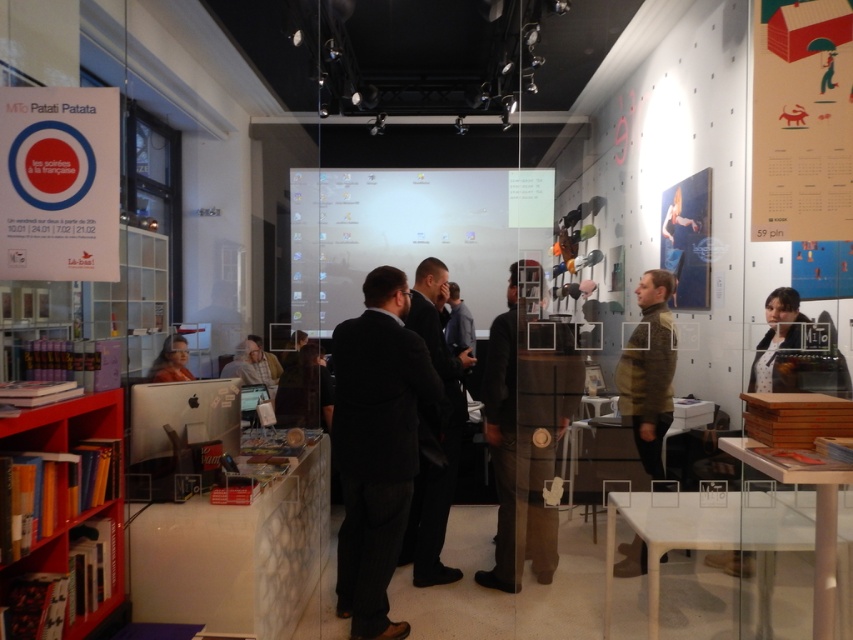
Question: Which object appears closest to the camera in this image?

Choices:
 (A) red wooden bookshelf at lower left
 (B) white paper poster at upper left
 (C) black woolen suit at center
 (D) matte paper calendar at upper right

Answer: (A)

Question: Which point is closer to the camera taking this photo?

Choices:
 (A) (763, 189)
 (B) (74, 273)

Answer: (B)

Question: Can you confirm if matte paper calendar at upper right is positioned to the right of red wooden bookshelf at lower left?

Choices:
 (A) no
 (B) yes

Answer: (B)

Question: Which point appears farthest from the camera in this image?

Choices:
 (A) (x=27, y=445)
 (B) (x=409, y=321)
 (C) (x=495, y=428)

Answer: (B)

Question: Is black suit at center further to the viewer compared to dark suit at center?

Choices:
 (A) yes
 (B) no

Answer: (B)

Question: Can you confirm if dark brown leather jacket at center is smaller than matte black monitor at lower left?

Choices:
 (A) no
 (B) yes

Answer: (A)